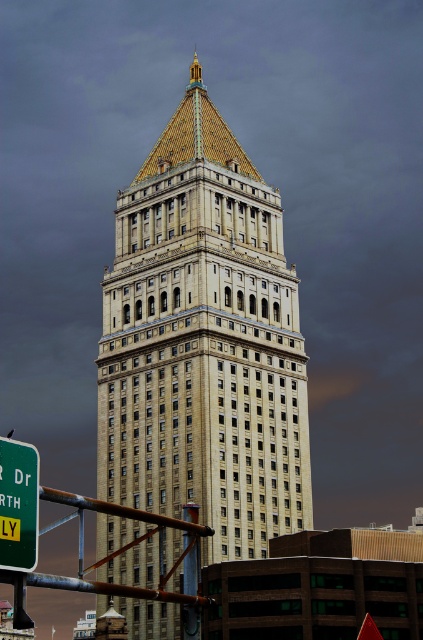
You are standing in front of the beige stone tower at center and the green plastic sign at lower left. Which object is taller?

The beige stone tower at center is taller than the green plastic sign at lower left.

You are standing in front of the beige stone tower at center and want to place a new green plastic sign at lower left. Based on the current arrangement, will the new sign be visible from the front entrance? Please explain your reasoning.

The beige stone tower at center is positioned over the green plastic sign at lower left. This means the tower blocks the view of the sign from the front entrance, so the new sign would not be visible.

You are standing in front of a historic building and notice a beige stone tower at center marked by point (203, 342). How would you describe the location of this point relative to the building?

The beige stone tower at center is located at the coordinates (203, 342), which places it centrally within the building structure.